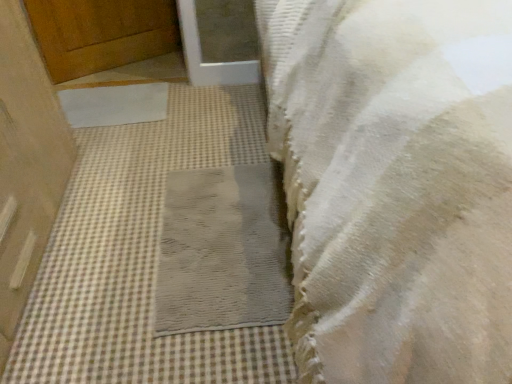
Question: Is there a large distance between white matte mat at center, the 2th mat in the front-to-back sequence, and wooden door at upper left, which appears as the 1th door when viewed from the back?

Choices:
 (A) yes
 (B) no

Answer: (B)

Question: Is white matte mat at center, the second mat in the right-to-left sequence, facing towards wooden door at upper left, the 2th door positioned from the front?

Choices:
 (A) no
 (B) yes

Answer: (A)

Question: Is wooden door at upper left, the 2th door positioned from the front, a part of white matte mat at center, arranged as the 1th mat when viewed from the top?

Choices:
 (A) no
 (B) yes

Answer: (A)

Question: Are white matte mat at center, the 2th mat in the bottom-to-top sequence, and wooden door at upper left, which appears as the 1th door when viewed from the back, making contact?

Choices:
 (A) no
 (B) yes

Answer: (A)

Question: From a real-world perspective, is white matte mat at center, arranged as the 1th mat when viewed from the top, under wooden door at upper left, the 2th door positioned from the front?

Choices:
 (A) yes
 (B) no

Answer: (B)

Question: Considering the positions of wooden door at upper left, which appears as the 1th door when viewed from the back, and gray textured mat at center, placed as the 2th mat when sorted from left to right, in the image, is wooden door at upper left, which appears as the 1th door when viewed from the back, wider or thinner than gray textured mat at center, placed as the 2th mat when sorted from left to right,?

Choices:
 (A) thin
 (B) wide

Answer: (B)

Question: Considering their positions, is wooden door at upper left, which is the first door from top to bottom, located in front of or behind gray textured mat at center, the 2th mat in the back-to-front sequence?

Choices:
 (A) behind
 (B) front

Answer: (A)

Question: Is wooden door at upper left, the 2th door positioned from the front, taller or shorter than gray textured mat at center, which is the 2th mat from top to bottom?

Choices:
 (A) short
 (B) tall

Answer: (B)

Question: From a real-world perspective, is wooden door at upper left, which is the first door from top to bottom, physically located above or below gray textured mat at center, the 2th mat in the back-to-front sequence?

Choices:
 (A) below
 (B) above

Answer: (B)

Question: Is white textured towel at lower right situated inside gray textured mat at center, marked as the 1th mat in a right-to-left arrangement, or outside?

Choices:
 (A) outside
 (B) inside

Answer: (A)

Question: Considering their positions, is white textured towel at lower right located in front of or behind gray textured mat at center, the first mat from the bottom?

Choices:
 (A) front
 (B) behind

Answer: (A)

Question: Considering the positions of white textured towel at lower right and gray textured mat at center, the 2th mat in the back-to-front sequence, in the image, is white textured towel at lower right taller or shorter than gray textured mat at center, the 2th mat in the back-to-front sequence,?

Choices:
 (A) short
 (B) tall

Answer: (B)

Question: Is point (399, 304) positioned closer to the camera than point (206, 198)?

Choices:
 (A) farther
 (B) closer

Answer: (B)

Question: Would you say gray textured mat at center, which is the 2th mat from top to bottom, is inside or outside white textured towel at lower right?

Choices:
 (A) outside
 (B) inside

Answer: (A)

Question: Is point (240, 231) closer or farther from the camera than point (343, 188)?

Choices:
 (A) farther
 (B) closer

Answer: (A)